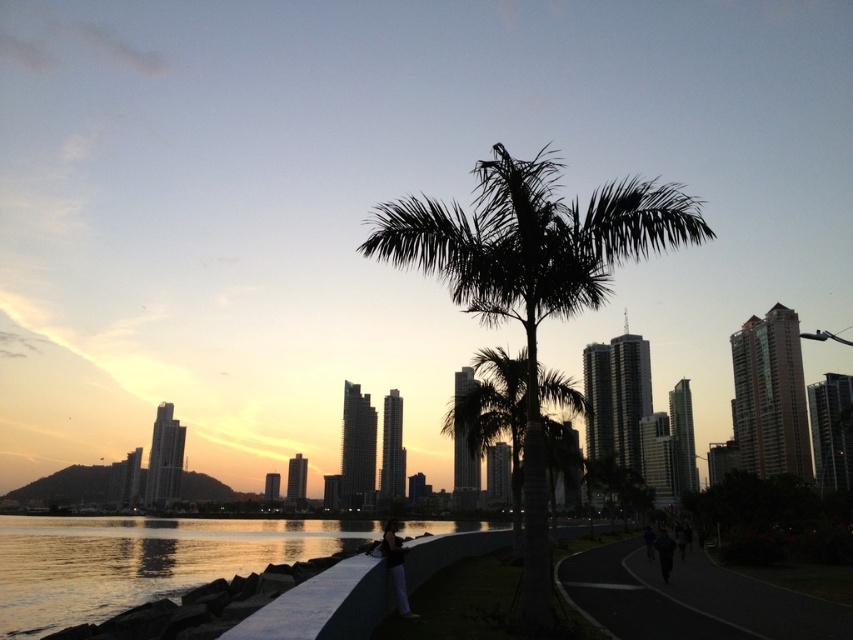
You are an urban planner analyzing the waterfront scene. You notice two palm trees described as the silhouette leafy palm at center and the green leafy palm tree at center. Which of these two trees has a wider spread of leaves?

The silhouette leafy palm at center might be wider than green leafy palm tree at center according to the description provided.

From the picture: You are a photographer standing at the waterfront scene. You see a black fabric pants at lower center and a dark fabric person at lower center in the frame. Which object is larger in the photo?

The black fabric pants at lower center is bigger than the dark fabric person at lower center in the photo.

You are a photographer standing at the water edge in this scene. You want to take a photo of the silhouette leafy palm at center and the smooth concrete wall at lower center. Which object will appear closer to the camera in the photo?

The silhouette leafy palm at center will appear closer to the camera because it is positioned in front of the smooth concrete wall at lower center.